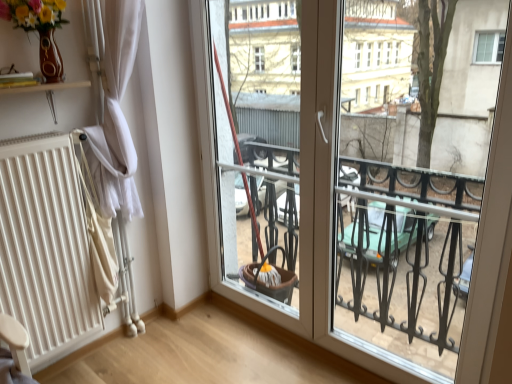
Describe the element at coordinates (39, 30) in the screenshot. I see `matte brown vase at upper left` at that location.

Where is `white fabric curtain at left`? The image size is (512, 384). white fabric curtain at left is located at coordinates (114, 106).

Consider the image. Is the depth of white matte radiator at left less than that of white fabric curtain at left?

Yes, it is in front of white fabric curtain at left.

Are white matte radiator at left and white fabric curtain at left located far from each other?

That's not correct — white matte radiator at left is a little close to white fabric curtain at left.

Which is farther, (53, 323) or (106, 116)?

Point (106, 116)

How different are the orientations of white matte radiator at left and white fabric curtain at left in degrees?

They differ by 0.00638 degrees in their facing directions.

From their relative heights in the image, would you say matte brown vase at upper left is taller or shorter than white fabric curtain at left?

matte brown vase at upper left is shorter than white fabric curtain at left.

Looking at the image, does matte brown vase at upper left seem bigger or smaller compared to white fabric curtain at left?

matte brown vase at upper left is bigger than white fabric curtain at left.

Is matte brown vase at upper left spatially inside white fabric curtain at left, or outside of it?

matte brown vase at upper left is not enclosed by white fabric curtain at left.

Is white fabric curtain at left touching white matte radiator at left?

No.

Which object is wider, white fabric curtain at left or white matte radiator at left?

With larger width is white matte radiator at left.

Is white fabric curtain at left inside the boundaries of white matte radiator at left, or outside?

The correct answer is: outside.

From the image's perspective, is white fabric curtain at left on top of white matte radiator at left?

Yes, from the image's perspective, white fabric curtain at left is above white matte radiator at left.

This screenshot has width=512, height=384. I want to click on floral arrangement lying above the white fabric curtain at left (from the image's perspective), so click(39, 30).

In the image, is white fabric curtain at left on the left side or the right side of matte brown vase at upper left?

From the image, it's evident that white fabric curtain at left is to the right of matte brown vase at upper left.

Is there a large distance between white fabric curtain at left and matte brown vase at upper left?

white fabric curtain at left is actually quite close to matte brown vase at upper left.

Considering the relative sizes of white fabric curtain at left and matte brown vase at upper left in the image provided, is white fabric curtain at left wider than matte brown vase at upper left?

Incorrect, the width of white fabric curtain at left does not surpass that of matte brown vase at upper left.

Which of these two, matte brown vase at upper left or white matte radiator at left, is bigger?

With larger size is white matte radiator at left.

From a real-world perspective, which is physically below, matte brown vase at upper left or white matte radiator at left?

white matte radiator at left.

Is matte brown vase at upper left next to white matte radiator at left and touching it?

No, matte brown vase at upper left is not in contact with white matte radiator at left.

Is point (18, 9) positioned before point (106, 244)?

Yes, point (18, 9) is in front of point (106, 244).

Can you see white matte radiator at left touching matte brown vase at upper left?

No, white matte radiator at left is not next to matte brown vase at upper left.

Who is smaller, white matte radiator at left or matte brown vase at upper left?

matte brown vase at upper left.

Is white matte radiator at left facing towards matte brown vase at upper left?

No, white matte radiator at left is not oriented towards matte brown vase at upper left.

Between white matte radiator at left and matte brown vase at upper left, which one appears on the left side from the viewer's perspective?

white matte radiator at left.

In order to click on curtain on the right side of white matte radiator at left in this screenshot , I will do `click(114, 106)`.

I want to click on floral arrangement that is above the white fabric curtain at left (from a real-world perspective), so click(39, 30).

Estimate the real-world distances between objects in this image. Which object is further from white fabric curtain at left, white matte radiator at left or matte brown vase at upper left?

Among the two, white matte radiator at left is located further to white fabric curtain at left.

Considering their positions, is matte brown vase at upper left positioned closer to white matte radiator at left than white fabric curtain at left?

white fabric curtain at left is closer to white matte radiator at left.

Looking at the image, which one is located further to matte brown vase at upper left, white fabric curtain at left or white matte radiator at left?

white matte radiator at left lies further to matte brown vase at upper left than the other object.

From the image, which object appears to be nearer to matte brown vase at upper left, white matte radiator at left or white fabric curtain at left?

Among the two, white fabric curtain at left is located nearer to matte brown vase at upper left.

Based on their spatial positions, is matte brown vase at upper left or white matte radiator at left closer to white fabric curtain at left?

The object closer to white fabric curtain at left is matte brown vase at upper left.

Estimate the real-world distances between objects in this image. Which object is further from white matte radiator at left, white fabric curtain at left or matte brown vase at upper left?

Among the two, matte brown vase at upper left is located further to white matte radiator at left.

Locate an element on the screen. curtain that lies between matte brown vase at upper left and white matte radiator at left from top to bottom is located at coordinates (114, 106).